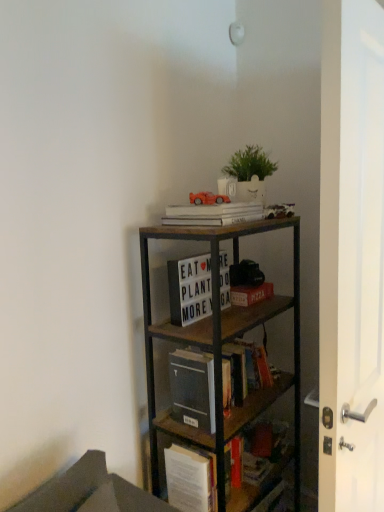
Question: Is white glossy door at right closer to camera compared to white matte book at upper center, the fourth book positioned from the bottom?

Choices:
 (A) yes
 (B) no

Answer: (A)

Question: From a real-world perspective, is white glossy door at right below white matte book at upper center, which ranks as the first book in top-to-bottom order?

Choices:
 (A) yes
 (B) no

Answer: (A)

Question: From a real-world perspective, is white glossy door at right over white matte book at upper center, which ranks as the first book in top-to-bottom order?

Choices:
 (A) no
 (B) yes

Answer: (A)

Question: Considering the relative sizes of white glossy door at right and white matte book at upper center, which ranks as the first book in top-to-bottom order, in the image provided, is white glossy door at right bigger than white matte book at upper center, which ranks as the first book in top-to-bottom order,?

Choices:
 (A) yes
 (B) no

Answer: (A)

Question: Are white glossy door at right and white matte book at upper center, which ranks as the first book in top-to-bottom order, far apart?

Choices:
 (A) no
 (B) yes

Answer: (A)

Question: Considering the positions of wooden bookcase at upper right and white matte letter board at center, arranged as the 2th book when viewed from the top, in the image, is wooden bookcase at upper right wider or thinner than white matte letter board at center, arranged as the 2th book when viewed from the top,?

Choices:
 (A) thin
 (B) wide

Answer: (B)

Question: Visually, is wooden bookcase at upper right positioned to the left or to the right of white matte letter board at center, which is counted as the third book, starting from the bottom?

Choices:
 (A) left
 (B) right

Answer: (B)

Question: Does point (213, 336) appear closer or farther from the camera than point (177, 274)?

Choices:
 (A) closer
 (B) farther

Answer: (A)

Question: From a real-world perspective, is wooden bookcase at upper right positioned above or below white matte letter board at center, which is counted as the third book, starting from the bottom?

Choices:
 (A) below
 (B) above

Answer: (A)

Question: From the image's perspective, relative to white glossy door at right, is matte cardboard book at center, the third book when ordered from top to bottom, above or below?

Choices:
 (A) below
 (B) above

Answer: (B)

Question: Do you think matte cardboard book at center, the third book when ordered from top to bottom, is within white glossy door at right, or outside of it?

Choices:
 (A) outside
 (B) inside

Answer: (A)

Question: Based on their sizes in the image, would you say matte cardboard book at center, which is the 2th book from bottom to top, is bigger or smaller than white glossy door at right?

Choices:
 (A) small
 (B) big

Answer: (A)

Question: From a real-world perspective, is matte cardboard book at center, the third book when ordered from top to bottom, above or below white glossy door at right?

Choices:
 (A) below
 (B) above

Answer: (A)

Question: Considering the relative positions of wooden book at center, which ranks as the 4th book in top-to-bottom order, and white matte letter board at center, arranged as the 2th book when viewed from the top, in the image provided, is wooden book at center, which ranks as the 4th book in top-to-bottom order, to the left or to the right of white matte letter board at center, arranged as the 2th book when viewed from the top,?

Choices:
 (A) left
 (B) right

Answer: (B)

Question: Considering the positions of wooden book at center, which ranks as the 4th book in top-to-bottom order, and white matte letter board at center, arranged as the 2th book when viewed from the top, in the image, is wooden book at center, which ranks as the 4th book in top-to-bottom order, taller or shorter than white matte letter board at center, arranged as the 2th book when viewed from the top,?

Choices:
 (A) tall
 (B) short

Answer: (B)